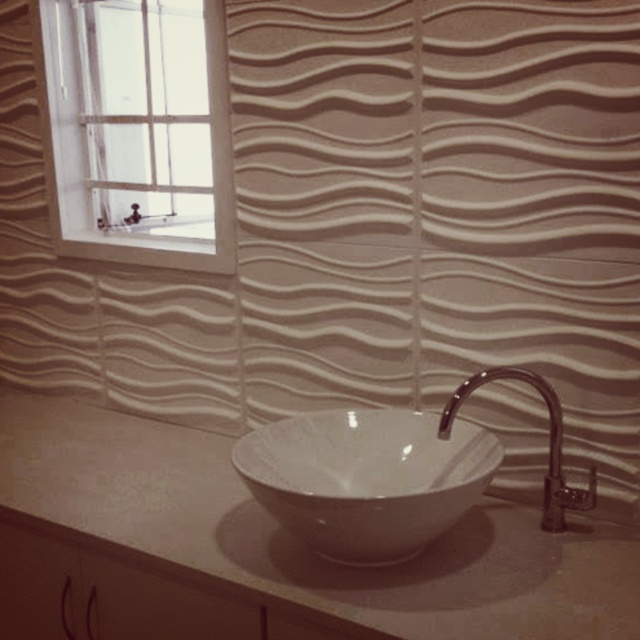
Question: Which object is the farthest from the white wooden window at upper left?

Choices:
 (A) white glossy countertop at center
 (B) white glossy basin at center
 (C) polished chrome faucet at right

Answer: (C)

Question: Which point is closer to the camera?

Choices:
 (A) white glossy basin at center
 (B) white glossy countertop at center
 (C) polished chrome faucet at right
 (D) white wooden window at upper left

Answer: (B)

Question: Does white wooden window at upper left have a lesser width compared to white glossy basin at center?

Choices:
 (A) yes
 (B) no

Answer: (B)

Question: Which point appears closest to the camera in this image?

Choices:
 (A) (600, 545)
 (B) (164, 244)
 (C) (460, 509)

Answer: (C)

Question: Does white glossy basin at center come in front of polished chrome faucet at right?

Choices:
 (A) no
 (B) yes

Answer: (B)

Question: Can you confirm if white glossy countertop at center is positioned below polished chrome faucet at right?

Choices:
 (A) no
 (B) yes

Answer: (B)